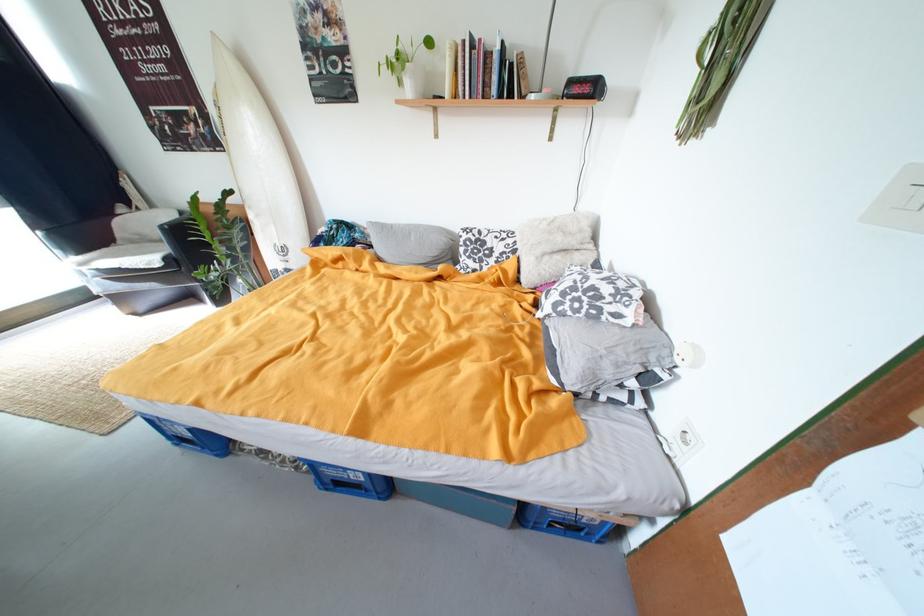
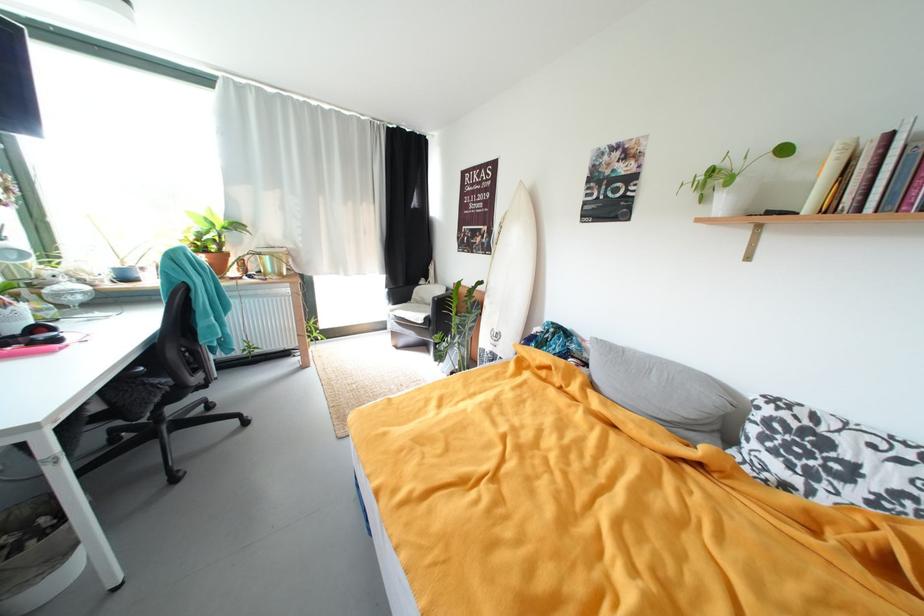
Locate, in the second image, the point that corresponds to (214,120) in the first image.

(497, 235)